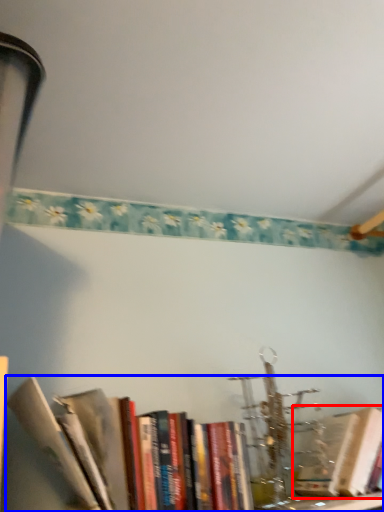
Question: Which point is closer to the camera, book (highlighted by a red box) or book (highlighted by a blue box)?

Choices:
 (A) book
 (B) book

Answer: (B)